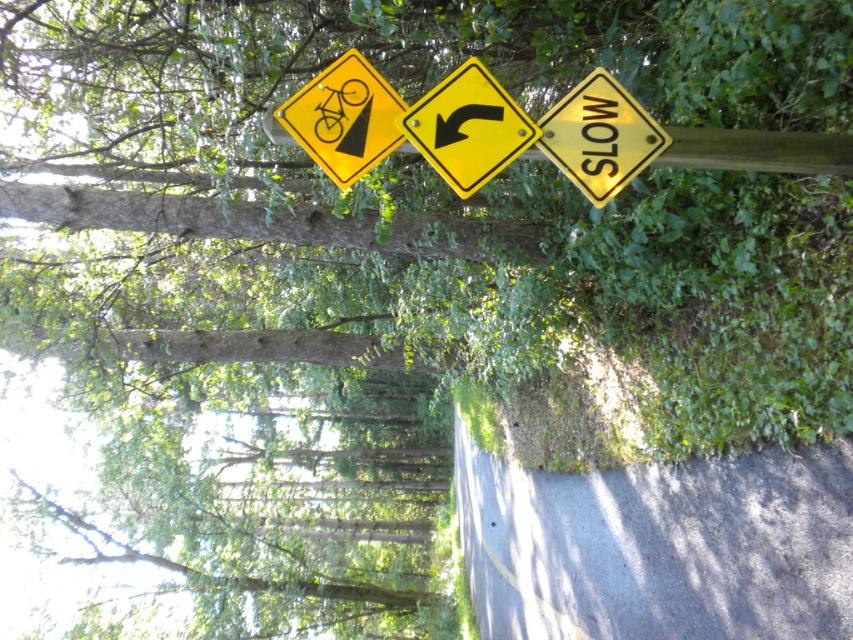
Is point (344, 124) positioned in front of point (602, 161)?

That is False.

How distant is yellow matte bicycle sign at upper center from yellow matte/solid sign at right?

yellow matte bicycle sign at upper center and yellow matte/solid sign at right are 23.48 inches apart from each other.

You are a GUI agent. You are given a task and a screenshot of the screen. Output one action in this format:
    pyautogui.click(x=<x>, y=<y>)
    Task: Click on the yellow matte bicycle sign at upper center
    The width and height of the screenshot is (853, 640).
    Given the screenshot: What is the action you would take?
    pyautogui.click(x=344, y=116)

Does yellow plastic arrow at center have a lesser width compared to yellow matte bicycle sign at upper center?

No, yellow plastic arrow at center is not thinner than yellow matte bicycle sign at upper center.

Is yellow plastic arrow at center shorter than yellow matte bicycle sign at upper center?

No.

Does point (424, 120) lie in front of point (299, 90)?

Yes, it is in front of point (299, 90).

Where is `yellow plastic arrow at center`? This screenshot has height=640, width=853. yellow plastic arrow at center is located at coordinates (467, 128).

Is point (450, 132) less distant than point (593, 160)?

Yes, it is in front of point (593, 160).

What do you see at coordinates (467, 128) in the screenshot?
I see `yellow plastic arrow at center` at bounding box center [467, 128].

Locate an element on the screen. yellow plastic arrow at center is located at coordinates (467, 128).